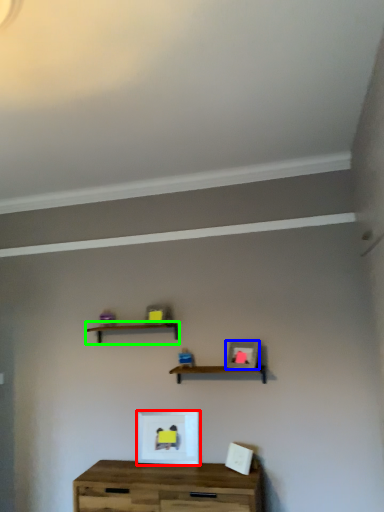
Question: Considering the real-world distances, which object is closest to picture frame (highlighted by a red box)? picture frame (highlighted by a blue box) or shelf (highlighted by a green box).

Choices:
 (A) picture frame
 (B) shelf

Answer: (A)